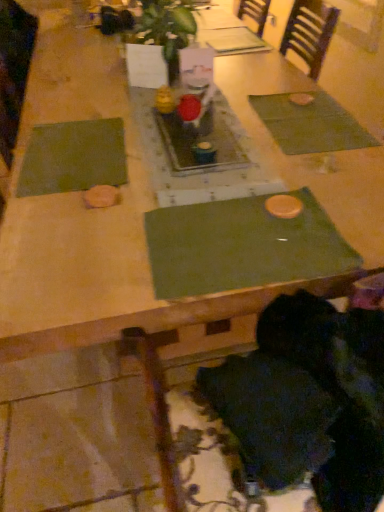
Locate an element on the screen. This screenshot has width=384, height=512. vacant region above green fabric place mat at center, which is counted as the 2th place mat, starting from the right (from a real-world perspective) is located at coordinates (235, 231).